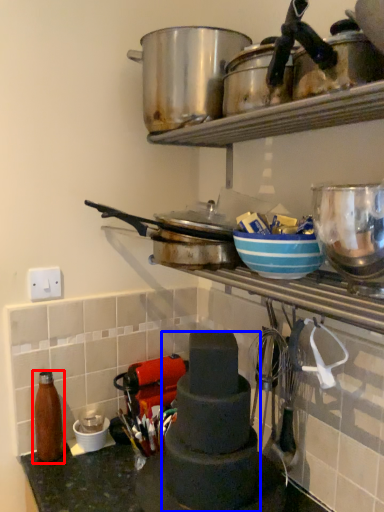
Question: Which object appears farthest to the camera in this image, bottle (highlighted by a red box) or appliance (highlighted by a blue box)?

Choices:
 (A) bottle
 (B) appliance

Answer: (A)